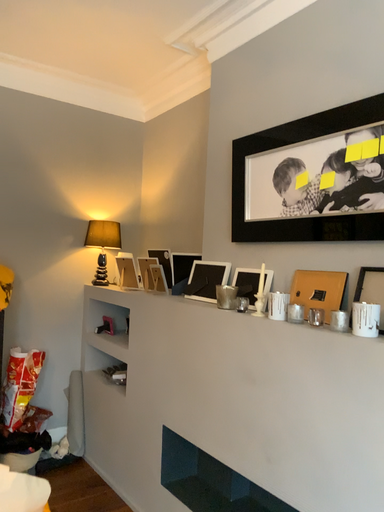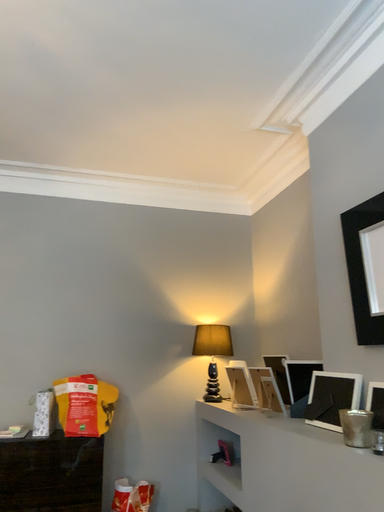
Question: Which way did the camera rotate in the video?

Choices:
 (A) rotated upward
 (B) rotated downward

Answer: (A)